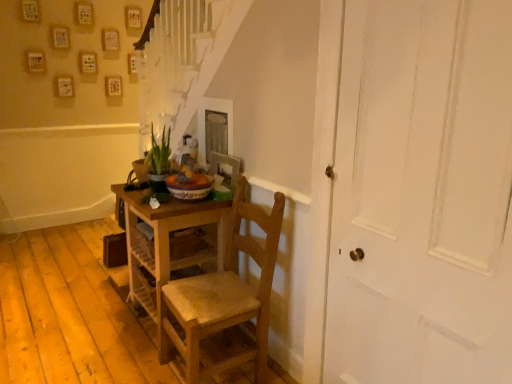
Question: From the image's perspective, relative to wooden chair at center, is white painted wood door at right above or below?

Choices:
 (A) above
 (B) below

Answer: (A)

Question: Is white painted wood door at right in front of or behind wooden chair at center in the image?

Choices:
 (A) behind
 (B) front

Answer: (B)

Question: Estimate the real-world distances between objects in this image. Which object is closer to the wooden picture frame at center?

Choices:
 (A) wooden desk at center
 (B) white painted wood door at right
 (C) green glossy plant at center
 (D) wooden chair at center

Answer: (C)

Question: Which object is the farthest from the wooden desk at center?

Choices:
 (A) wooden chair at center
 (B) wooden picture frame at center
 (C) white painted wood door at right
 (D) green glossy plant at center

Answer: (C)